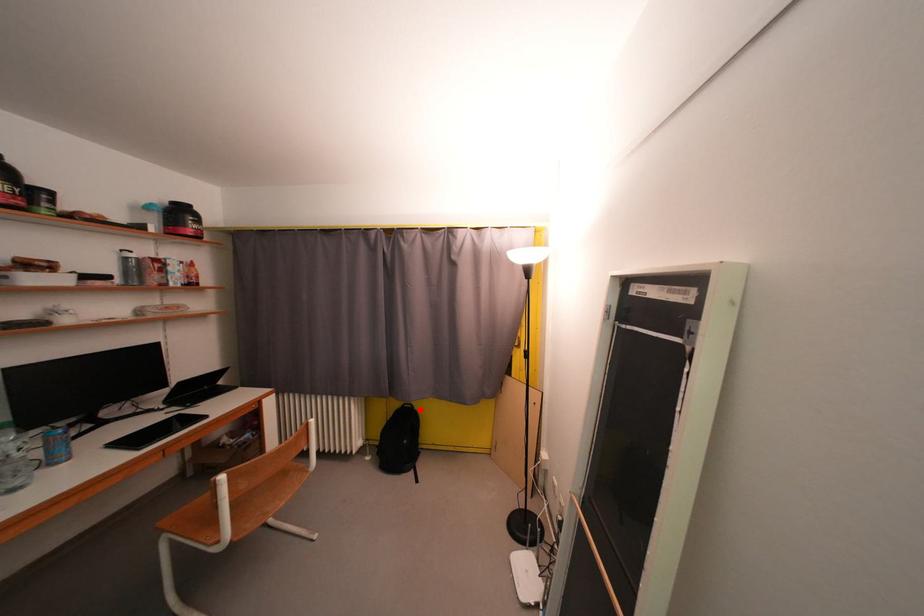
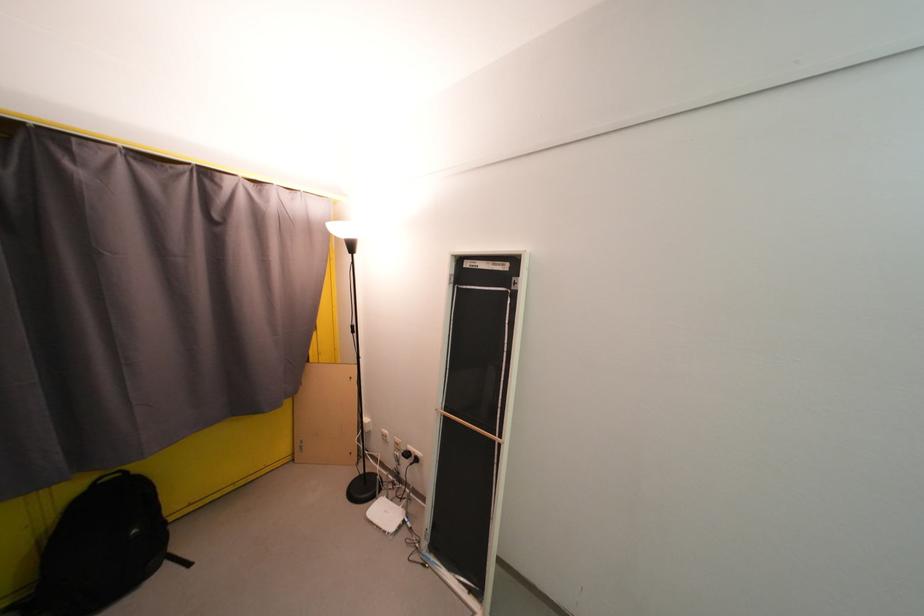
Question: I am providing you with two images of the same scene from different viewpoints. In image1, a red point is highlighted. Considering the same 3D point in image2, which of the following is correct?

Choices:
 (A) It is closer
 (B) It is farther

Answer: (A)